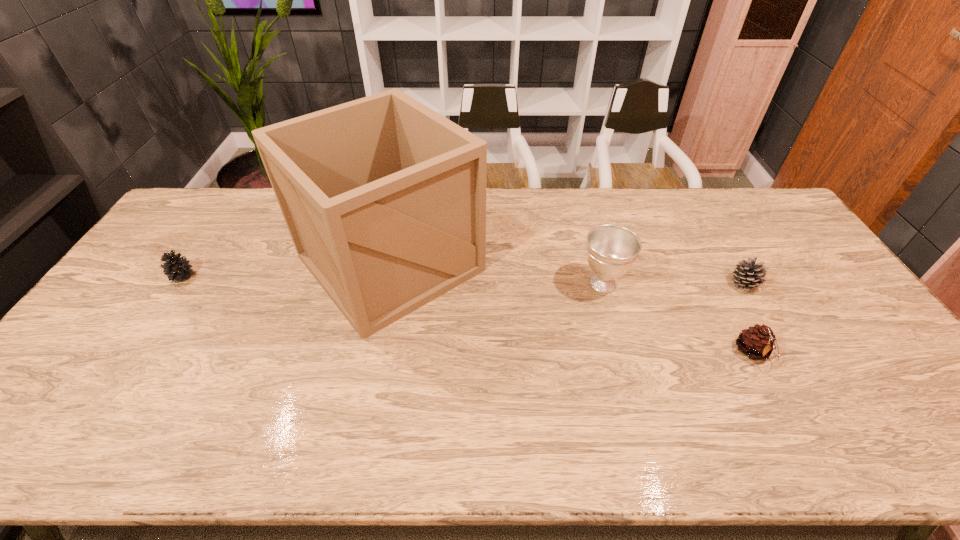
At what (x,y) coordinates should I click in order to perform the action: click on the fourth object from right to left. Please return your answer as a coordinate pair (x, y). This screenshot has height=540, width=960. Looking at the image, I should click on (385, 199).

Locate an element on the screen. This screenshot has width=960, height=540. box is located at coordinates (385, 199).

At what (x,y) coordinates should I click in order to perform the action: click on the second tallest object. Please return your answer as a coordinate pair (x, y). The image size is (960, 540). Looking at the image, I should click on (611, 250).

Image resolution: width=960 pixels, height=540 pixels. What are the coordinates of `the third object from right to left` in the screenshot? It's located at (611, 250).

The image size is (960, 540). I want to click on the leftmost pinecone, so click(177, 268).

Find the location of a particular element. Image resolution: width=960 pixels, height=540 pixels. the nearest pinecone is located at coordinates (758, 342).

The height and width of the screenshot is (540, 960). Find the location of `vacant area situated on the right of the box`. vacant area situated on the right of the box is located at coordinates (574, 263).

The height and width of the screenshot is (540, 960). I want to click on free region located on the right of the chalice, so click(647, 284).

Identify the location of free space located on the right of the leftmost pinecone. The image size is (960, 540). (313, 276).

Locate an element on the screen. This screenshot has height=540, width=960. vacant position located 0.130m with a leaf charm attached to the nearest pinecone is located at coordinates (787, 419).